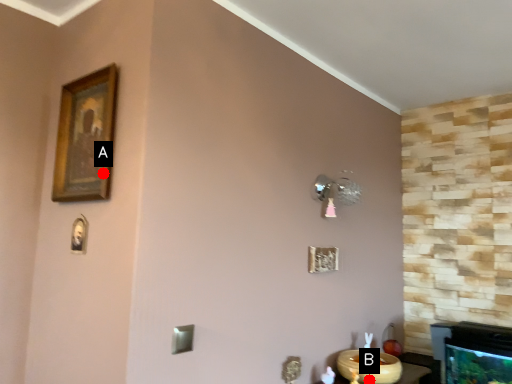
Question: Two points are circled on the image, labeled by A and B beside each circle. Which of the following is the closest to the observer?

Choices:
 (A) A is closer
 (B) B is closer

Answer: (A)